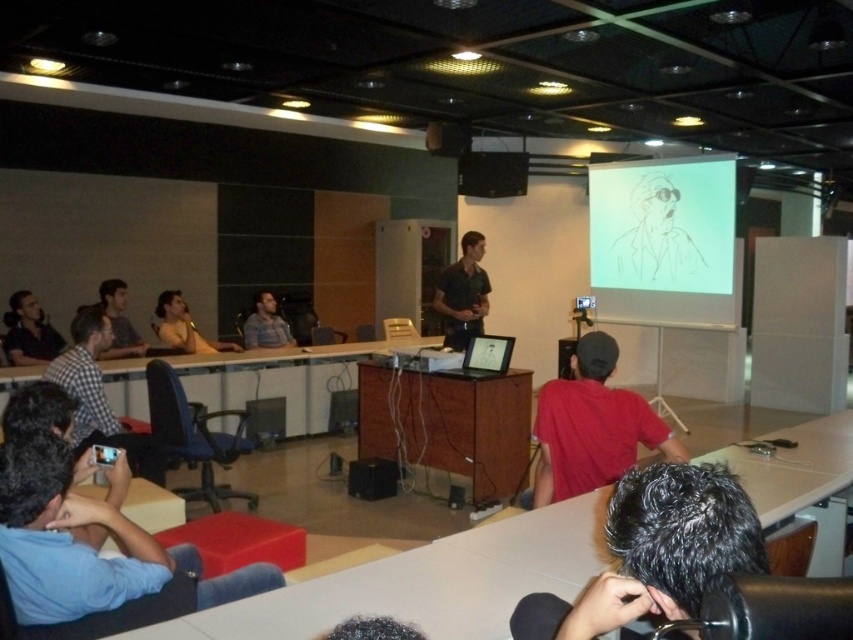
Between matte black shirt at left and matte black speaker at upper center, which one is positioned higher?

matte black speaker at upper center

Can you confirm if matte black shirt at left is thinner than matte black speaker at upper center?

No, matte black shirt at left is not thinner than matte black speaker at upper center.

Who is more distant from viewer, (39, 355) or (486, 189)?

The point (486, 189) is behind.

Locate an element on the screen. The image size is (853, 640). matte black shirt at left is located at coordinates [x=28, y=332].

Does point (605, 419) come in front of point (33, 342)?

Yes.

Which of these two, red matte shirt at lower right or matte black shirt at left, stands shorter?

matte black shirt at left

The height and width of the screenshot is (640, 853). What do you see at coordinates (592, 426) in the screenshot?
I see `red matte shirt at lower right` at bounding box center [592, 426].

What are the coordinates of `red matte shirt at lower right` in the screenshot? It's located at (592, 426).

Which is below, red matte shirt at lower right or plaid fabric shirt at center?

red matte shirt at lower right is below.

Who is more forward, (573, 493) or (270, 317)?

Point (573, 493) is more forward.

The image size is (853, 640). In order to click on red matte shirt at lower right in this screenshot , I will do `click(592, 426)`.